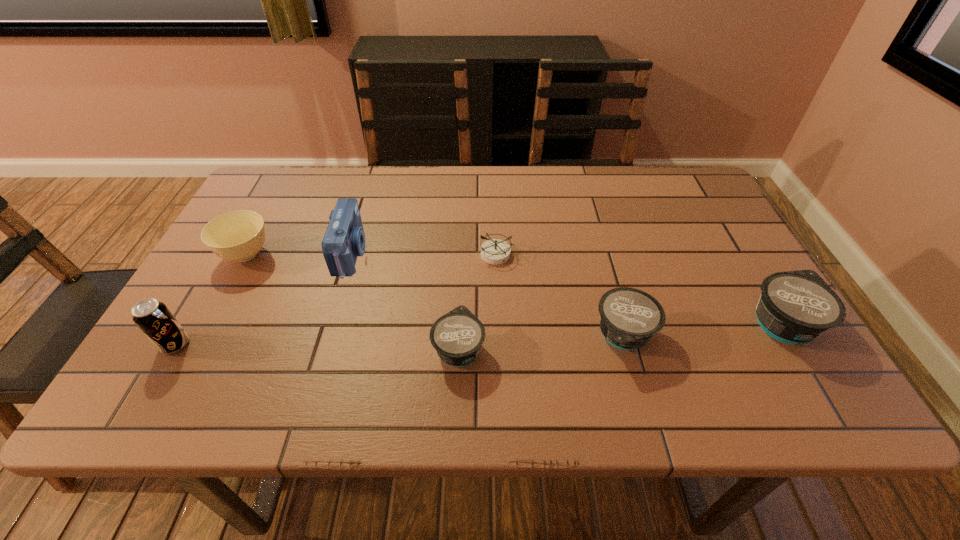
The image size is (960, 540). Identify the location of free location located on the back of the rightmost object. (732, 241).

What are the coordinates of `blank area located 0.320m on the back of the sugar bowl` in the screenshot? It's located at (292, 170).

This screenshot has height=540, width=960. Identify the location of free space located on the lens of the third object from left to right. (421, 253).

Find the location of a particular element. The image size is (960, 540). vacant space located on the left of the compass is located at coordinates (381, 254).

Image resolution: width=960 pixels, height=540 pixels. What are the coordinates of `free space located on the back of the soda can` in the screenshot? It's located at (218, 270).

I want to click on soda can that is positioned at the near edge, so click(x=154, y=319).

You are a GUI agent. You are given a task and a screenshot of the screen. Output one action in this format:
    pyautogui.click(x=<x>, y=<y>)
    Task: Click on the sugar bowl at the left edge
    The height and width of the screenshot is (540, 960).
    Given the screenshot: What is the action you would take?
    pyautogui.click(x=239, y=235)

This screenshot has width=960, height=540. In order to click on soda can present at the left edge in this screenshot , I will do `click(154, 319)`.

Where is `object that is at the right edge`? This screenshot has width=960, height=540. object that is at the right edge is located at coordinates (794, 307).

Find the location of a particular element. This screenshot has width=960, height=540. object present at the near left corner is located at coordinates (154, 319).